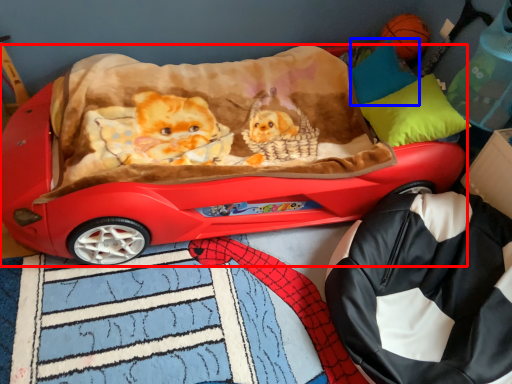
Question: Which of the following is the closest to the observer, car (highlighted by a red box) or pillow (highlighted by a blue box)?

Choices:
 (A) car
 (B) pillow

Answer: (A)